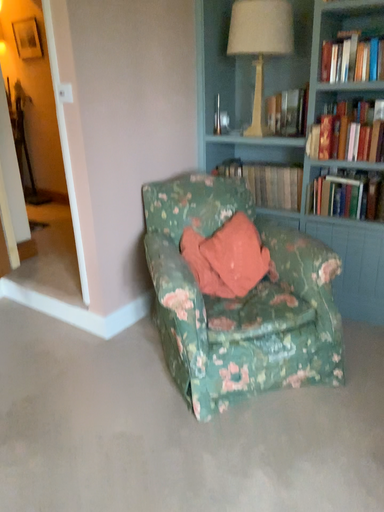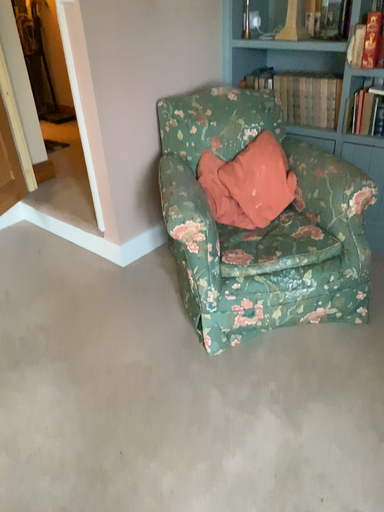
Question: Which way did the camera rotate in the video?

Choices:
 (A) rotated upward
 (B) rotated downward

Answer: (B)